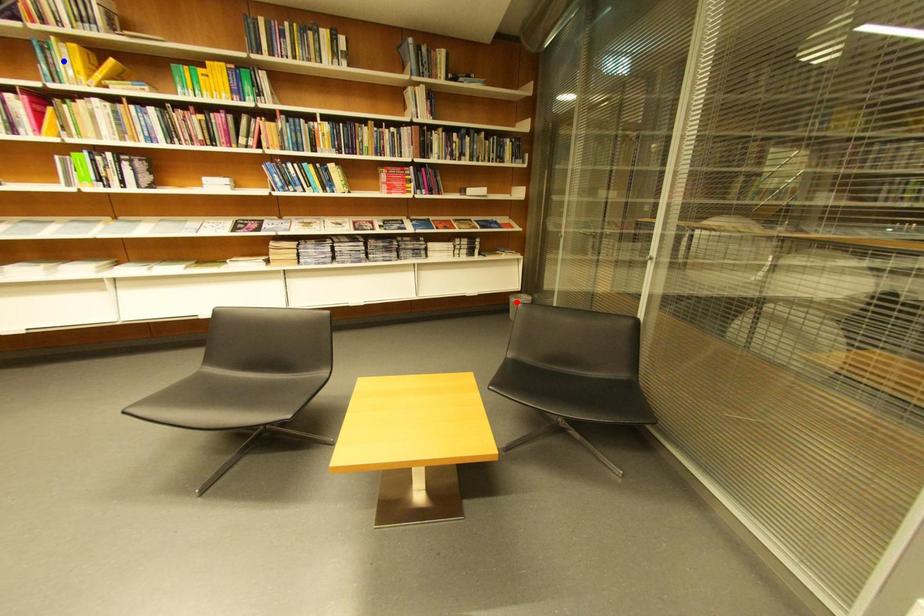
Question: In the image, two points are highlighted. Which point is nearer to the camera? Reply with the corresponding letter.

Choices:
 (A) blue point
 (B) red point

Answer: (A)